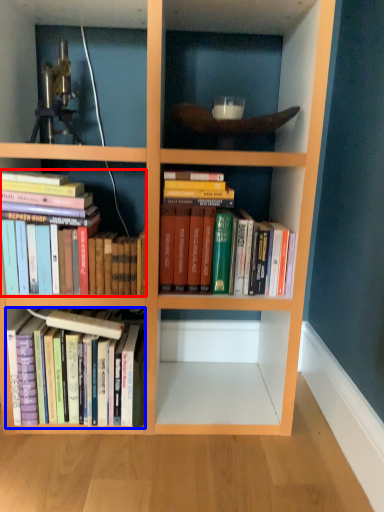
Question: Which of the following is the closest to the observer, book (highlighted by a red box) or book (highlighted by a blue box)?

Choices:
 (A) book
 (B) book

Answer: (A)